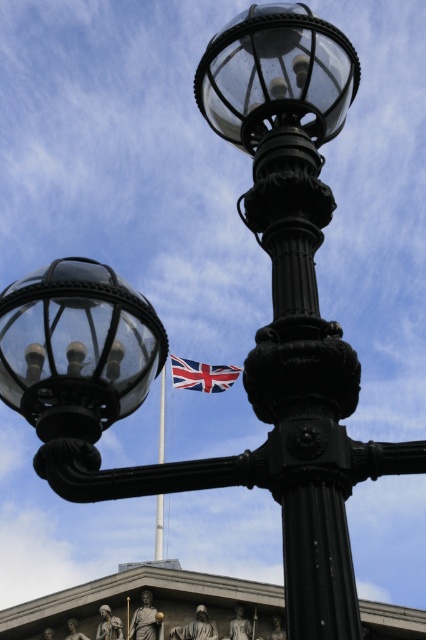
You are an architect designing a new public space and want to ensure that the red and white striped fabric at center does not block the light from the matte glass streetlamp at upper center. Based on their relative heights, which object should be placed higher to achieve this?

The matte glass streetlamp at upper center has a greater height compared to the red and white striped fabric at center. To prevent the fabric from blocking the light, the matte glass streetlamp at upper center should be placed higher than the red and white striped fabric at center.

You are a photographer standing at a certain distance from the matte glass streetlamp at upper center. You want to capture a photo where the streetlamp fills the frame without being too close to avoid distortion. Given that the recommended distance for such shots is between 20 to 25 meters, is your current position suitable?

The matte glass streetlamp at upper center is 19.50 meters from the camera, which is just below the recommended 20 to 25 meters range. This means the photographer is slightly too close, potentially causing some distortion in the photo. To achieve the desired result, moving back a bit to reach at least 20 meters would be advisable.

You are a photographer trying to capture the matte glass streetlamp at upper center and the metallic flag pole at center in a single shot. Based on their positions, which object will appear closer to the camera in the photo?

The matte glass streetlamp at upper center will appear closer to the camera because it is positioned in front of the metallic flag pole at center.